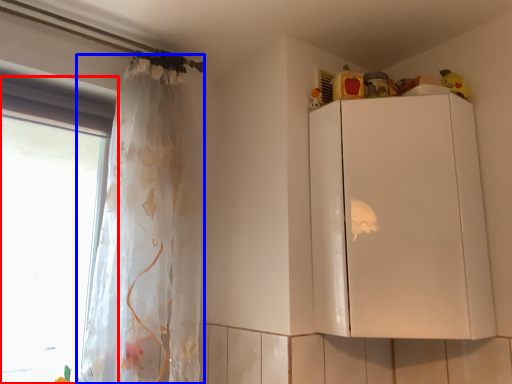
Question: Which object appears closest to the camera in this image, window (highlighted by a red box) or curtain (highlighted by a blue box)?

Choices:
 (A) window
 (B) curtain

Answer: (B)